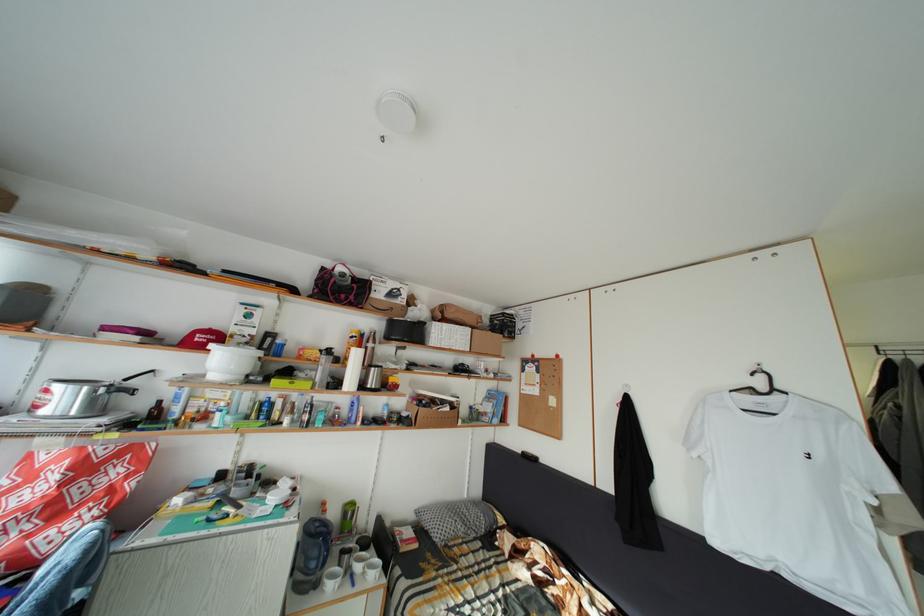
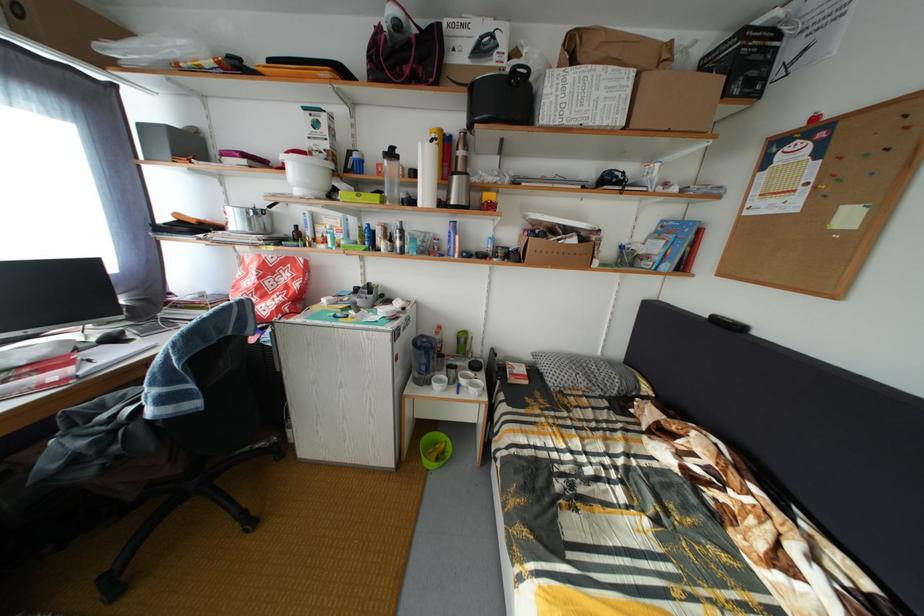
Where in the second image is the point corresponding to (322,537) from the first image?

(428, 350)